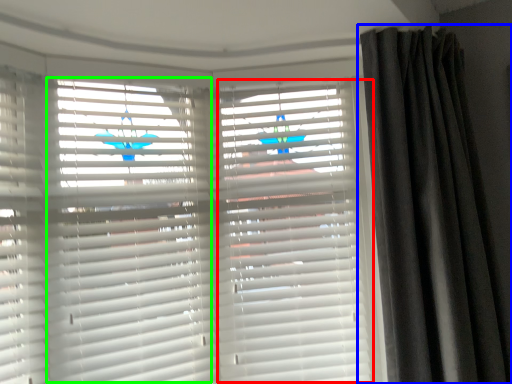
Question: Which is nearer to the shutter (highlighted by a red box)? curtain (highlighted by a blue box) or shutter (highlighted by a green box).

Choices:
 (A) curtain
 (B) shutter

Answer: (A)